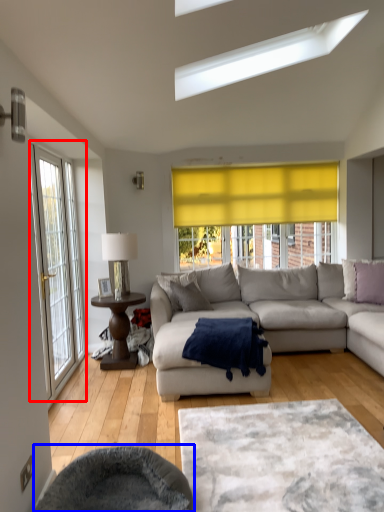
Question: Among these objects, which one is nearest to the camera, door (highlighted by a red box) or swivel chair (highlighted by a blue box)?

Choices:
 (A) door
 (B) swivel chair

Answer: (B)